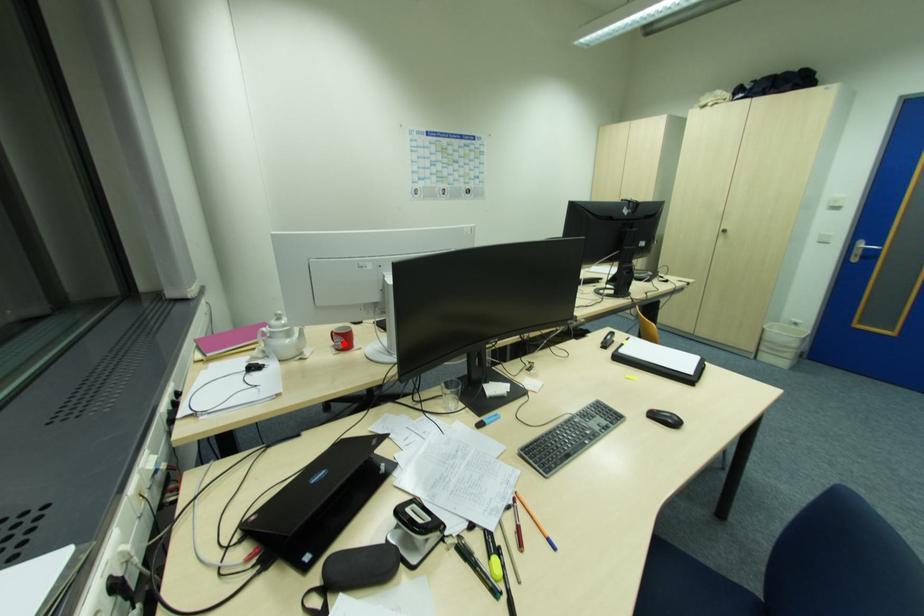
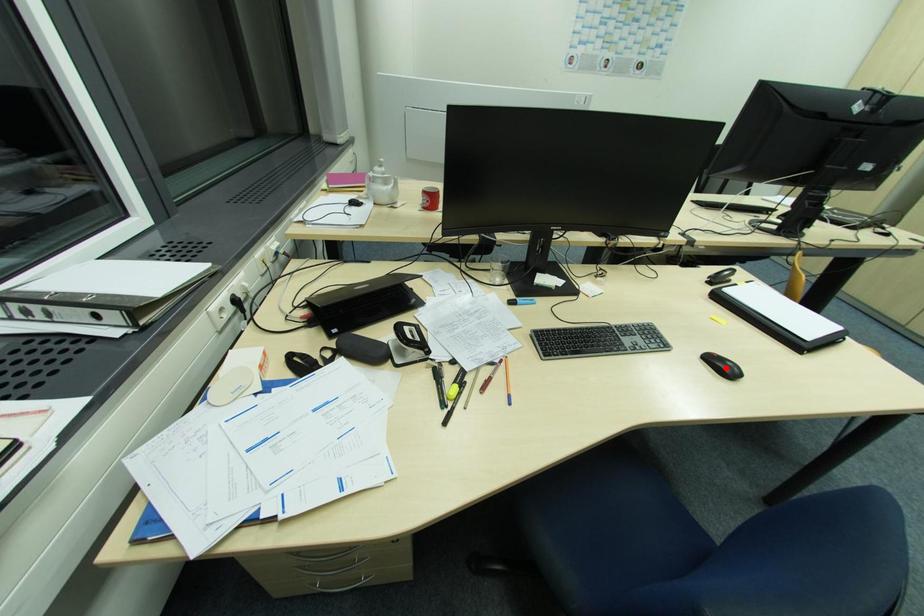
I am providing you with two images of the same scene from different viewpoints. A red point is marked on the first image and another point is marked on the second image. Does the point marked in image1 correspond to the same location as the one in image2?

No